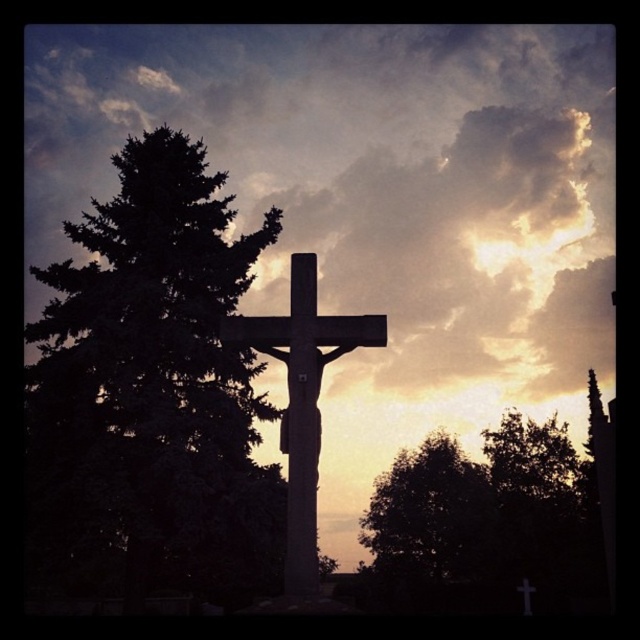
Question: Among these points, which one is nearest to the camera?

Choices:
 (A) (168, 200)
 (B) (525, 579)
 (C) (417, 548)
 (D) (502, 54)

Answer: (A)

Question: Is cloudy sky at upper center wider than dark green leafy tree at lower right?

Choices:
 (A) no
 (B) yes

Answer: (B)

Question: Observing the image, what is the correct spatial positioning of cloudy sky at upper center in reference to dark green leafy tree at lower right?

Choices:
 (A) below
 (B) above

Answer: (B)

Question: Which object is the closest to the smooth stone cross at center?

Choices:
 (A) cloudy sky at upper center
 (B) dark green leafy tree at lower right
 (C) matte stone cross at center

Answer: (B)

Question: Does cloudy sky at upper center have a greater width compared to matte stone cross at center?

Choices:
 (A) yes
 (B) no

Answer: (A)

Question: Which point is farther to the camera?

Choices:
 (A) (532, 186)
 (B) (296, 310)
 (C) (93, 316)
 (D) (433, 492)

Answer: (A)